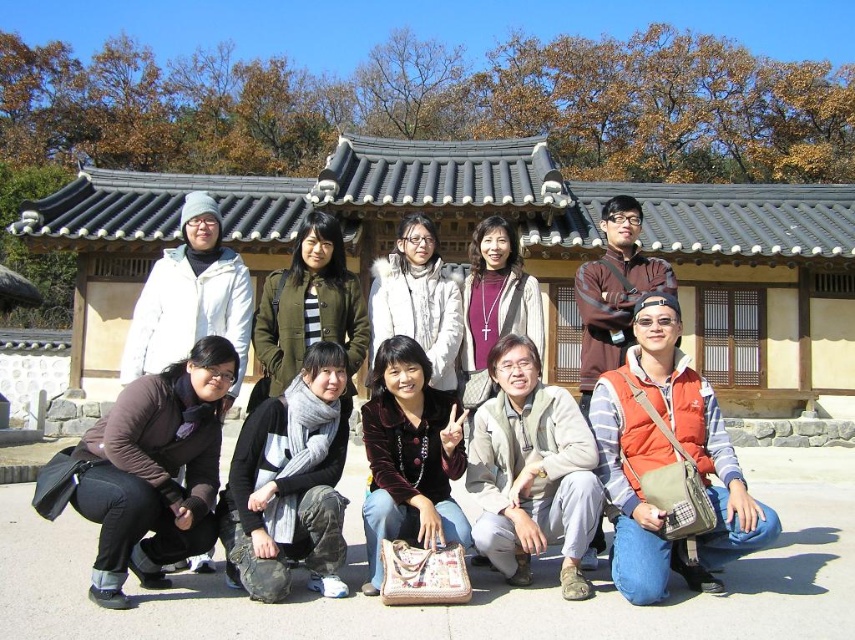
Who is positioned more to the right, beige fabric jacket at lower center or velvet brown jacket at lower center?

beige fabric jacket at lower center

Who is positioned more to the left, beige fabric jacket at lower center or velvet brown jacket at lower center?

Positioned to the left is velvet brown jacket at lower center.

Between point (575, 541) and point (437, 406), which one is positioned in front?

Positioned in front is point (575, 541).

Locate an element on the screen. This screenshot has height=640, width=855. beige fabric jacket at lower center is located at coordinates (531, 470).

Which of these two, gray wool scarf at center or velvet brown jacket at lower center, stands taller?

Standing taller between the two is velvet brown jacket at lower center.

Who is higher up, gray wool scarf at center or velvet brown jacket at lower center?

gray wool scarf at center is higher up.

Is point (269, 544) more distant than point (402, 346)?

No, (269, 544) is in front of (402, 346).

This screenshot has width=855, height=640. I want to click on gray wool scarf at center, so click(290, 483).

What do you see at coordinates (531, 470) in the screenshot? The image size is (855, 640). I see `beige fabric jacket at lower center` at bounding box center [531, 470].

Is beige fabric jacket at lower center wider than brown wool sweater at center?

Yes, beige fabric jacket at lower center is wider than brown wool sweater at center.

The image size is (855, 640). What do you see at coordinates (531, 470) in the screenshot?
I see `beige fabric jacket at lower center` at bounding box center [531, 470].

At what (x,y) coordinates should I click in order to perform the action: click on beige fabric jacket at lower center. Please return your answer as a coordinate pair (x, y). The height and width of the screenshot is (640, 855). Looking at the image, I should click on (531, 470).